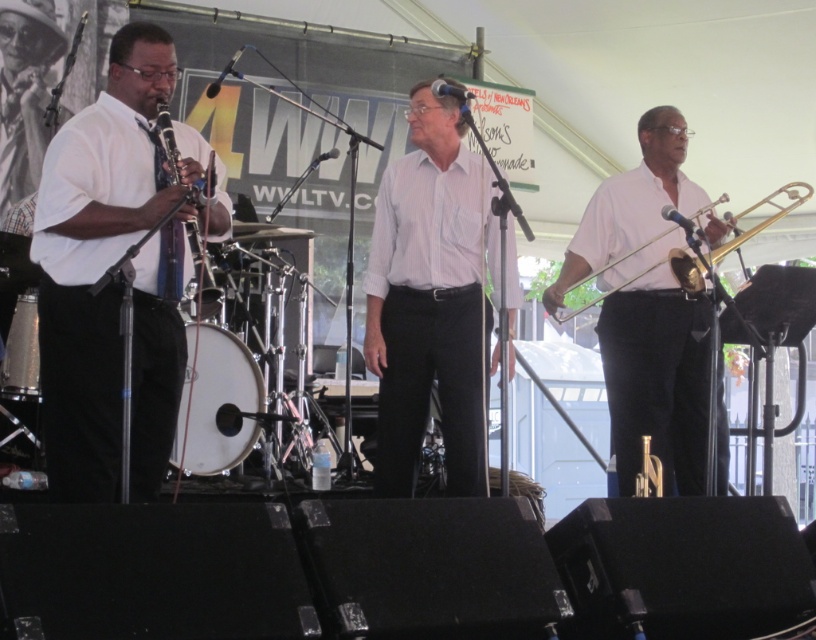
Does matte white shirt at left appear over gold brass trombone at right?

Actually, matte white shirt at left is below gold brass trombone at right.

Can you confirm if matte white shirt at left is shorter than gold brass trombone at right?

No, matte white shirt at left is not shorter than gold brass trombone at right.

Identify the location of matte white shirt at left. Image resolution: width=816 pixels, height=640 pixels. (100, 253).

Locate an element on the screen. The height and width of the screenshot is (640, 816). matte white shirt at left is located at coordinates (100, 253).

Does matte white shirt at left appear on the right side of white matte trombone at center?

No, matte white shirt at left is not to the right of white matte trombone at center.

Identify the location of matte white shirt at left. (100, 253).

This screenshot has width=816, height=640. What are the coordinates of `matte white shirt at left` in the screenshot? It's located at (100, 253).

Does matte white shirt at left have a greater width compared to matte black clarinet at left?

Yes.

Locate an element on the screen. matte white shirt at left is located at coordinates (100, 253).

At what (x,y) coordinates should I click in order to perform the action: click on matte white shirt at left. Please return your answer as a coordinate pair (x, y). Looking at the image, I should click on (100, 253).